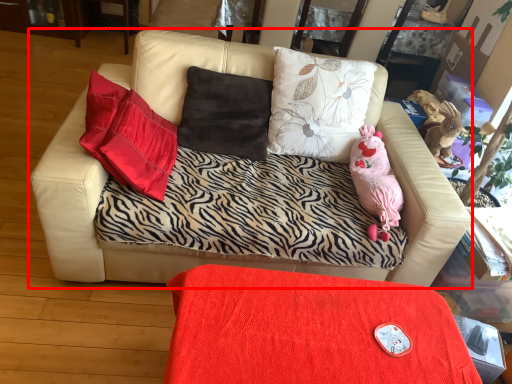
Question: From the image's perspective, where is studio couch (annotated by the red box) located relative to table?

Choices:
 (A) above
 (B) below

Answer: (A)